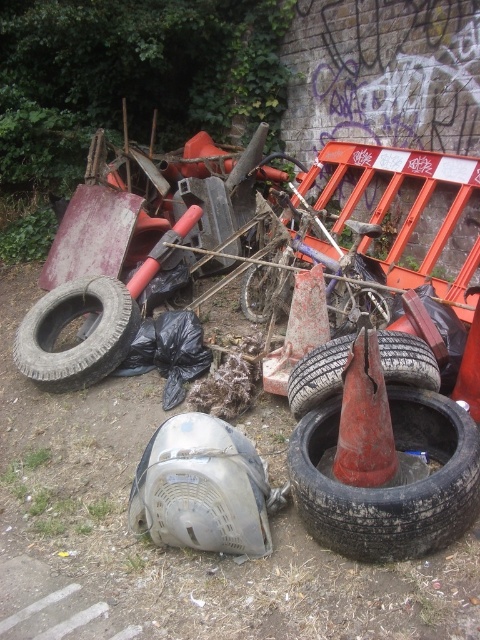
Question: From the image, what is the correct spatial relationship of black rubber tire at lower center in relation to rubber tire at center?

Choices:
 (A) left
 (B) right

Answer: (B)

Question: Which object is closer to the camera taking this photo?

Choices:
 (A) rubber tire at center
 (B) flat black tire at lower right

Answer: (B)

Question: Is gray rubber tire at lower left above smooth orange traffic cone at center?

Choices:
 (A) yes
 (B) no

Answer: (A)

Question: Among these objects, which one is nearest to the camera?

Choices:
 (A) smooth orange traffic cone at center
 (B) flat black tire at lower right
 (C) black rubber tire at lower center

Answer: (C)

Question: Is black rubber tire at lower center bigger than smooth red traffic cone at center?

Choices:
 (A) yes
 (B) no

Answer: (A)

Question: Among these objects, which one is farthest from the camera?

Choices:
 (A) smooth orange traffic cone at center
 (B) rubber tire at center

Answer: (B)